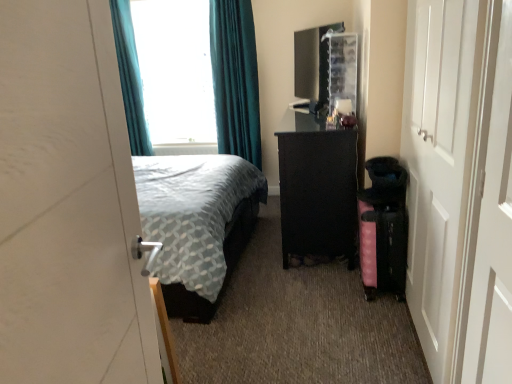
Locate an element on the screen. vacant area situated to the left side of white wooden door at right, the first door from the right is located at coordinates (307, 350).